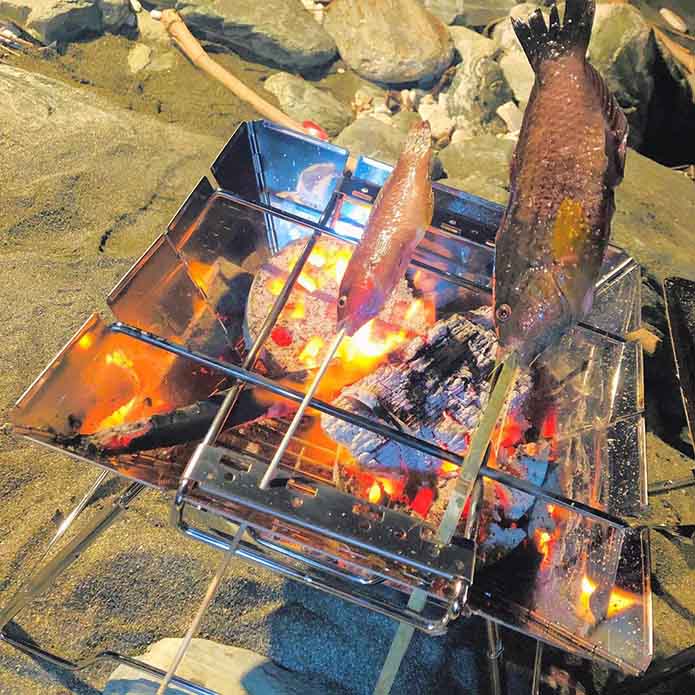
The image size is (695, 695). I want to click on stand, so click(181, 268).